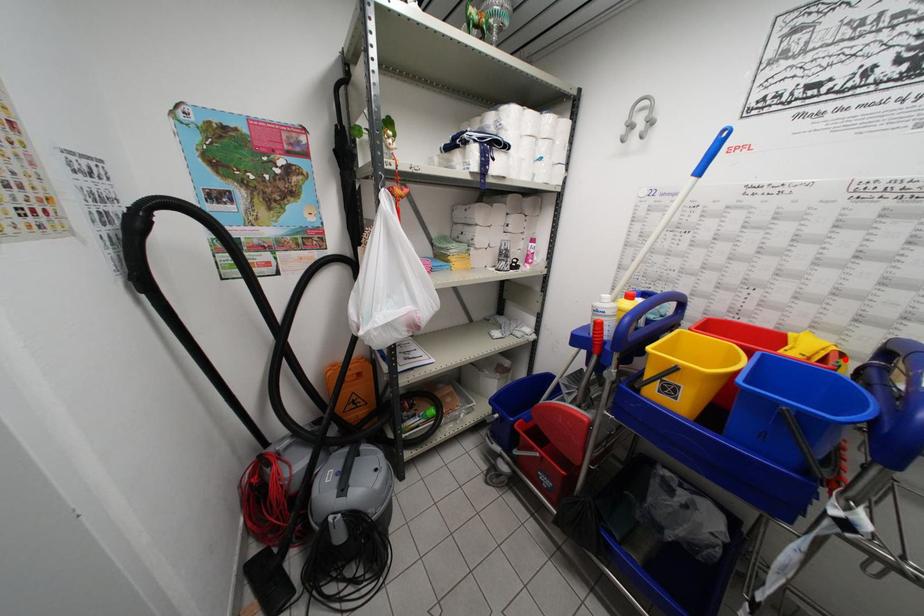
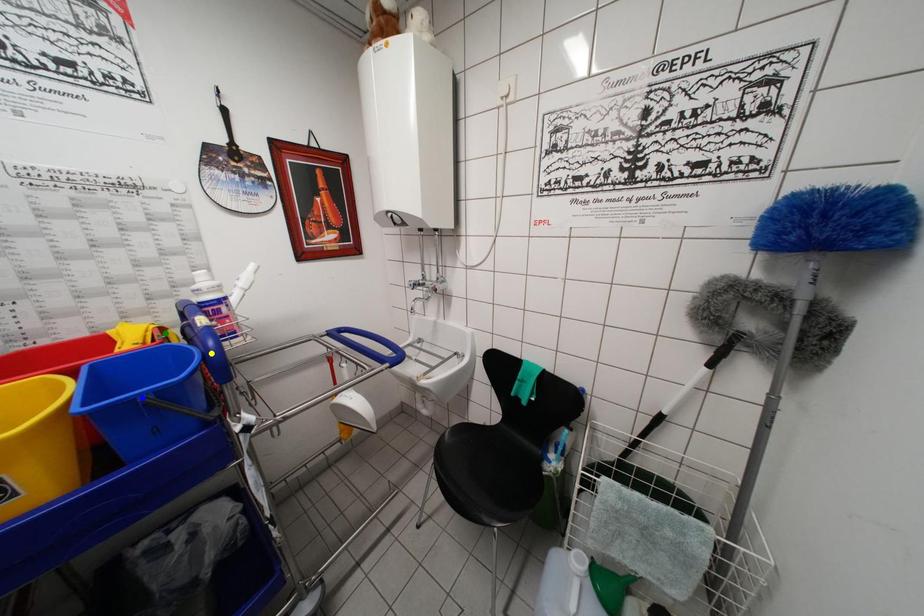
Question: I am providing you with two images of the same scene from different viewpoints. A red point is marked on the first image. You are given multiple points on the second image. Can you choose the point in image 2 that corresponds to the point in image 1?

Choices:
 (A) yellow point
 (B) blue point
 (C) green point

Answer: (C)